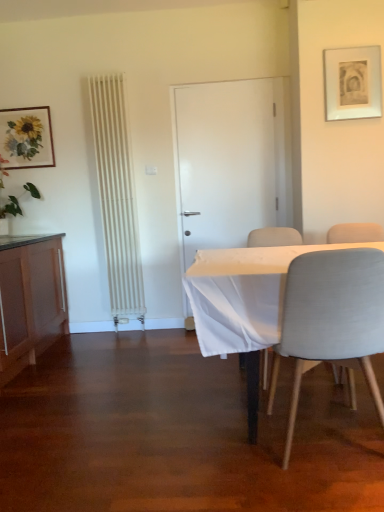
This screenshot has height=512, width=384. What are the coordinates of `vacant space positioned to the left of light gray fabric chair at lower right, the third chair positioned from the back` in the screenshot? It's located at (204, 466).